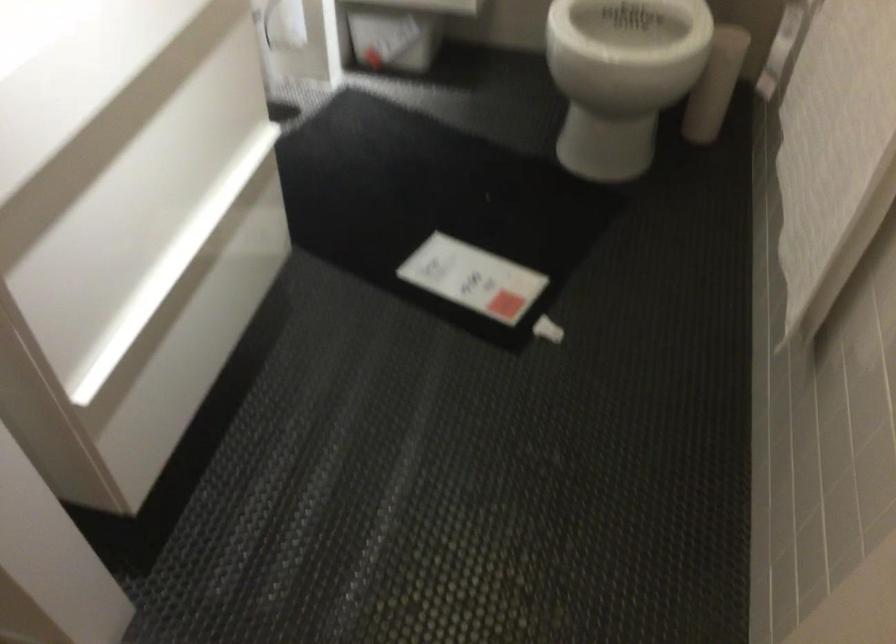
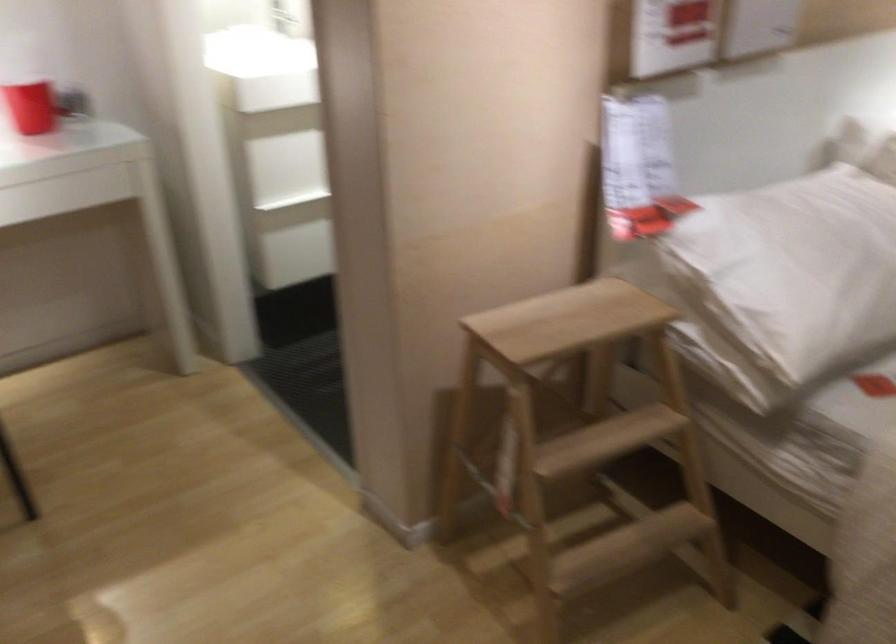
Question: I am providing you with two images of the same scene from different viewpoints. Which of the following objects are not visible in image2?

Choices:
 (A) white paper tag
 (B) red plastic crate
 (C) red cup
 (D) wooden step stool

Answer: (A)